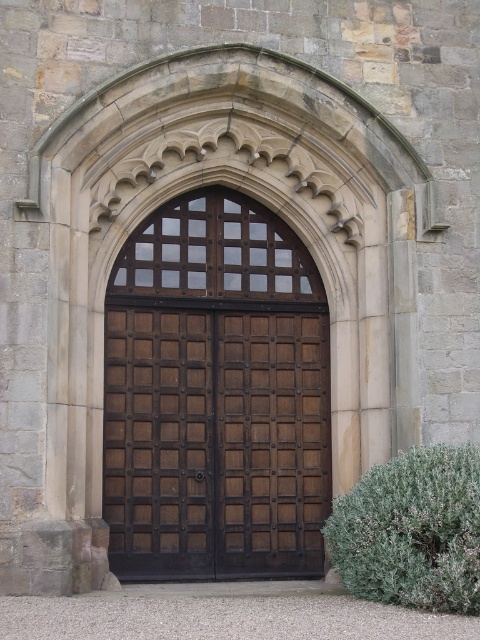
You are a painter standing at the entrance of the stone building. You need to paint the brown wooden door at center and the green leafy bush at lower right. Which object requires more paint considering their sizes?

The brown wooden door at center requires more paint than the green leafy bush at lower right because it is larger in size.

You are standing in front of the stone building and want to enter through the doorway. Which object, the brown wooden door at center or the green leafy bush at lower right, is closer to you?

The brown wooden door at center is closer to you because it is further to the viewer than the green leafy bush at lower right, meaning it is positioned nearer in the visual perspective.